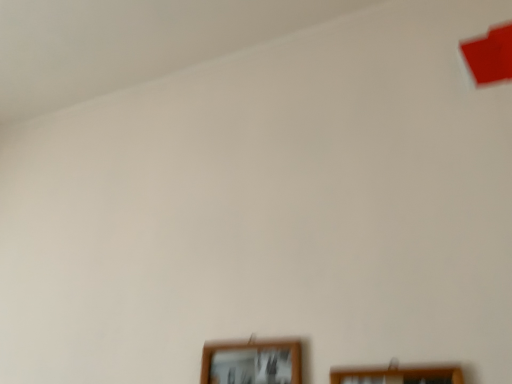
Question: From the image's perspective, is wooden picture frame at lower center, marked as the 2th picture frame in a right-to-left arrangement, positioned above or below wooden picture frame at lower right, the 1th picture frame viewed from the right?

Choices:
 (A) above
 (B) below

Answer: (B)

Question: In the image, is wooden picture frame at lower center, which ranks as the 1th picture frame in left-to-right order, positioned in front of or behind wooden picture frame at lower right, the 1th picture frame viewed from the right?

Choices:
 (A) behind
 (B) front

Answer: (A)

Question: Looking at their shapes, would you say wooden picture frame at lower center, marked as the 2th picture frame in a right-to-left arrangement, is wider or thinner than wooden picture frame at lower right, which ranks as the 2th picture frame in left-to-right order?

Choices:
 (A) wide
 (B) thin

Answer: (A)

Question: Relative to wooden picture frame at lower center, marked as the 2th picture frame in a right-to-left arrangement, is wooden picture frame at lower right, which ranks as the 2th picture frame in left-to-right order, in front or behind?

Choices:
 (A) front
 (B) behind

Answer: (A)

Question: Is wooden picture frame at lower right, the 1th picture frame viewed from the right, inside the boundaries of wooden picture frame at lower center, marked as the 2th picture frame in a right-to-left arrangement, or outside?

Choices:
 (A) inside
 (B) outside

Answer: (B)

Question: From the image's perspective, relative to wooden picture frame at lower center, which ranks as the 1th picture frame in left-to-right order, is wooden picture frame at lower right, which ranks as the 2th picture frame in left-to-right order, above or below?

Choices:
 (A) above
 (B) below

Answer: (A)

Question: From their relative heights in the image, would you say wooden picture frame at lower right, the 1th picture frame viewed from the right, is taller or shorter than wooden picture frame at lower center, which ranks as the 1th picture frame in left-to-right order?

Choices:
 (A) short
 (B) tall

Answer: (A)